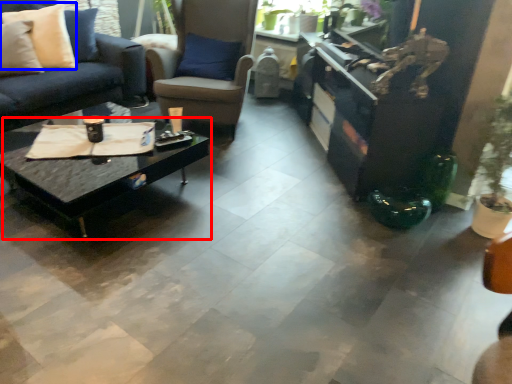
Question: Among these objects, which one is farthest to the camera, coffee table (highlighted by a red box) or pillow (highlighted by a blue box)?

Choices:
 (A) coffee table
 (B) pillow

Answer: (B)